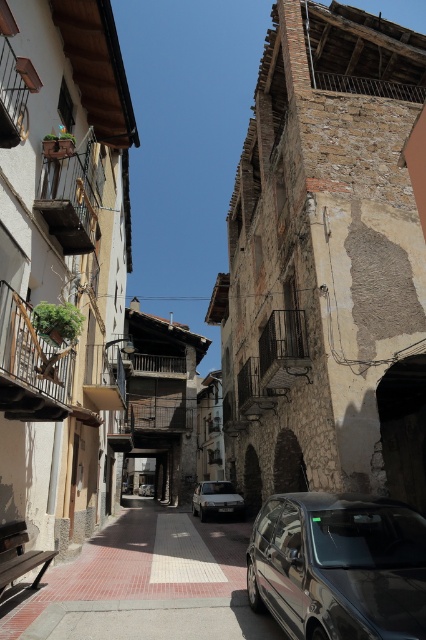
Question: Is smooth concrete pavement at center smaller than glossy metallic van at lower right?

Choices:
 (A) yes
 (B) no

Answer: (B)

Question: Among these points, which one is nearest to the camera?

Choices:
 (A) (39, 595)
 (B) (307, 582)
 (C) (195, 490)

Answer: (B)

Question: Does smooth concrete pavement at center have a smaller size compared to glossy metallic van at lower right?

Choices:
 (A) no
 (B) yes

Answer: (A)

Question: Which object appears closest to the camera in this image?

Choices:
 (A) silver metallic car at center
 (B) smooth concrete pavement at center
 (C) glossy metallic van at lower right

Answer: (C)

Question: Is smooth concrete pavement at center in front of silver metallic car at center?

Choices:
 (A) no
 (B) yes

Answer: (B)

Question: Which point is farther to the camera?

Choices:
 (A) (377, 512)
 (B) (206, 499)
 (C) (192, 593)

Answer: (B)